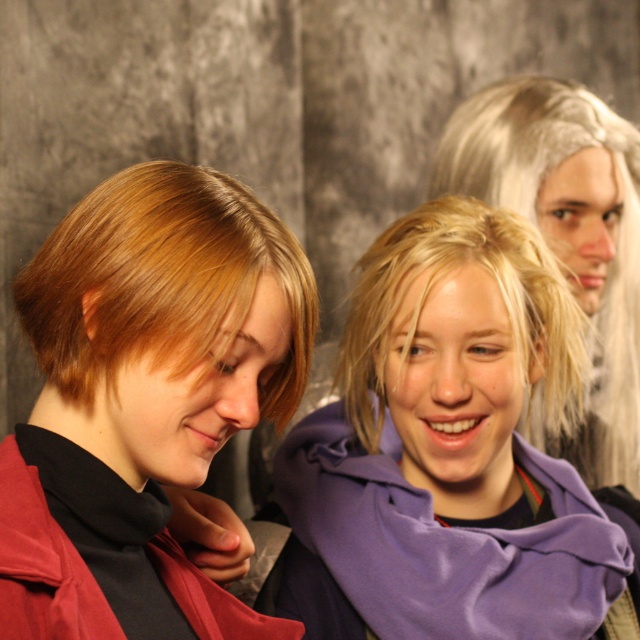
You are standing in front of the image and want to touch the two points mentioned. Which point, point (524,125) or point (35,632), is closer to you?

Point (524,125) is closer to you because it is further to the viewer than point (35,632).

You are an artist trying to paint this scene. You need to decide which object should be placed higher in your painting. Based on the description, which one between the purple fleece scarf at center and the matte red jacket at lower left should be positioned higher?

The purple fleece scarf at center should be positioned higher in the painting because it has a greater height compared to the matte red jacket at lower left.

You are organizing a winter clothing sale and need to display the purple fleece scarf at center and the matte red coat at left. Which item requires a larger display space due to its size?

The purple fleece scarf at center requires a larger display space because it is larger in size than the matte red coat at left.